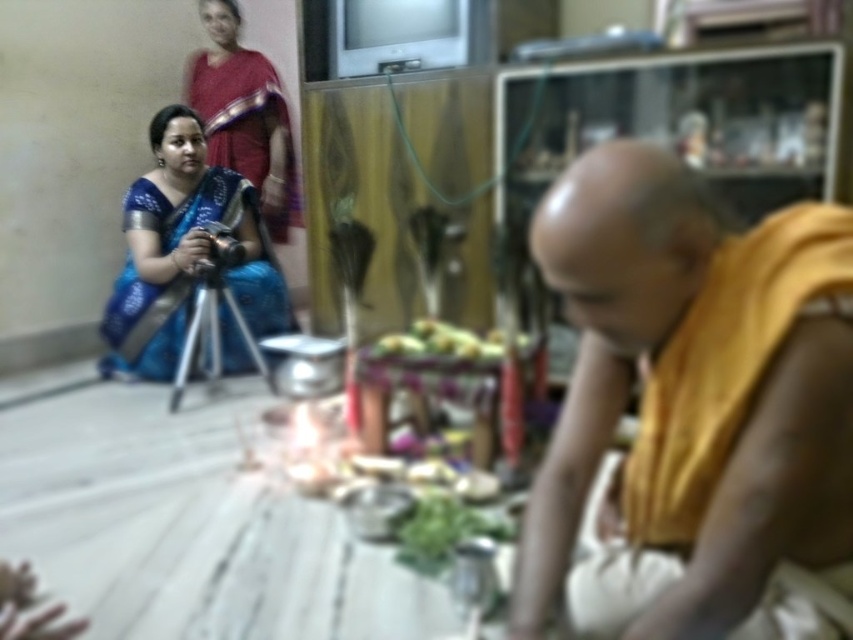
Question: Which point appears closest to the camera in this image?

Choices:
 (A) (604, 300)
 (B) (466, 355)
 (C) (231, 340)
 (D) (258, 150)

Answer: (A)

Question: Does yellow clothed monk at center have a greater width compared to matte red saree at upper left?

Choices:
 (A) yes
 (B) no

Answer: (B)

Question: Is yellow clothed monk at center positioned behind blue silk saree at left?

Choices:
 (A) yes
 (B) no

Answer: (B)

Question: Observing the image, what is the correct spatial positioning of blue silk saree at left in reference to matte red saree at upper left?

Choices:
 (A) right
 (B) left

Answer: (B)

Question: Estimate the real-world distances between objects in this image. Which object is closer to the yellowish matte fruit at center?

Choices:
 (A) yellow clothed monk at center
 (B) matte red saree at upper left

Answer: (A)

Question: Estimate the real-world distances between objects in this image. Which object is closer to the yellow clothed monk at center?

Choices:
 (A) matte red saree at upper left
 (B) blue silk saree at left
 (C) yellowish matte fruit at center

Answer: (C)